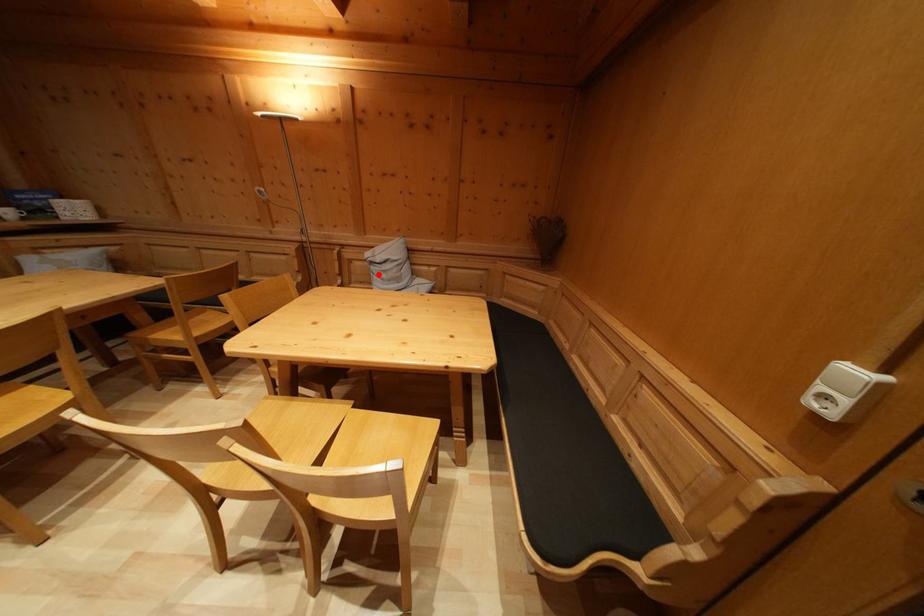
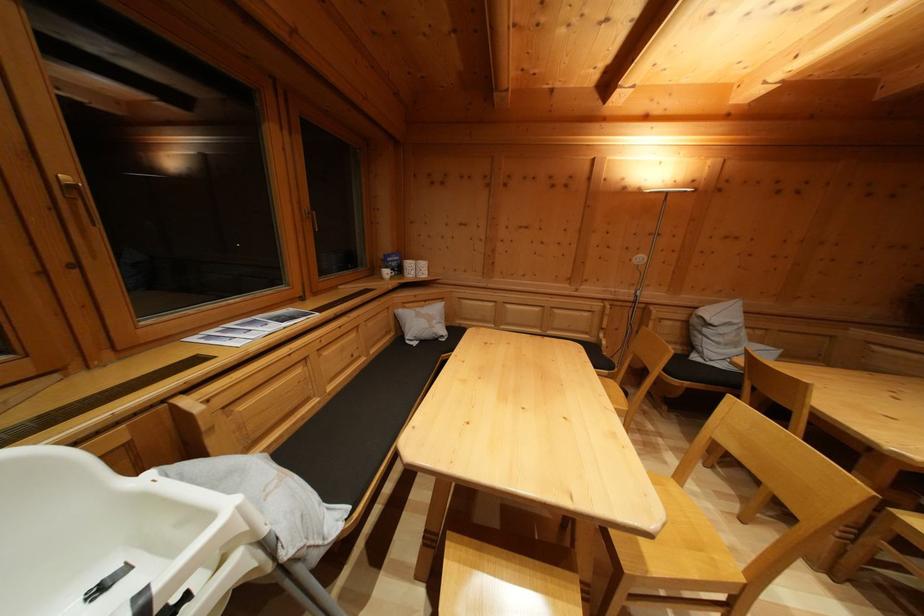
Find the pixel in the second image that matches the highlighted location in the first image.

(711, 337)